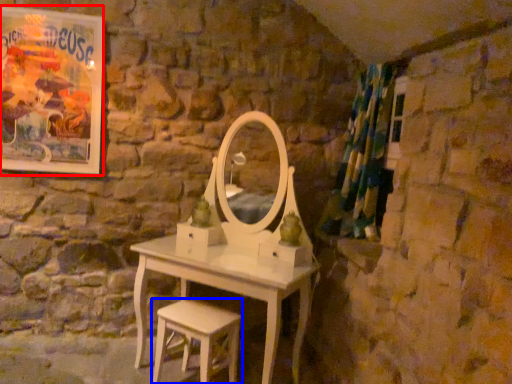
Question: Which object appears closest to the camera in this image, poster page (highlighted by a red box) or stool (highlighted by a blue box)?

Choices:
 (A) poster page
 (B) stool

Answer: (B)